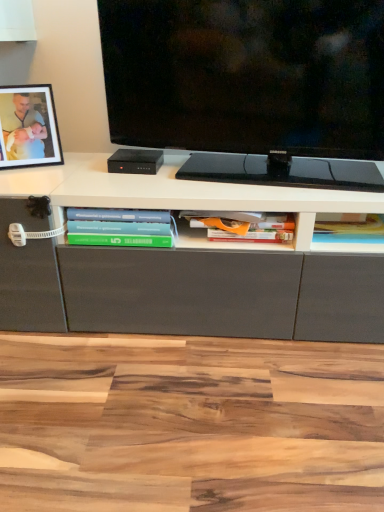
Question: Is black glossy tv at center wider than green matte book at lower left, which is the 1th book from left to right?

Choices:
 (A) no
 (B) yes

Answer: (A)

Question: Is black glossy tv at center completely or partially outside of green matte book at lower left, marked as the 3th book in a right-to-left arrangement?

Choices:
 (A) no
 (B) yes

Answer: (B)

Question: Does black glossy tv at center have a smaller size compared to green matte book at lower left, marked as the 3th book in a right-to-left arrangement?

Choices:
 (A) no
 (B) yes

Answer: (A)

Question: From the image's perspective, is black glossy tv at center on green matte book at lower left, which is the 1th book from left to right?

Choices:
 (A) no
 (B) yes

Answer: (B)

Question: Does black glossy tv at center have a greater height compared to green matte book at lower left, which is the 1th book from left to right?

Choices:
 (A) no
 (B) yes

Answer: (B)

Question: Based on their sizes in the image, would you say black matte picture frame at upper left is bigger or smaller than black glossy tv at center?

Choices:
 (A) big
 (B) small

Answer: (B)

Question: From a real-world perspective, is black matte picture frame at upper left physically located above or below black glossy tv at center?

Choices:
 (A) above
 (B) below

Answer: (B)

Question: Which is correct: black matte picture frame at upper left is inside black glossy tv at center, or outside of it?

Choices:
 (A) inside
 (B) outside

Answer: (B)

Question: Looking at their shapes, would you say black matte picture frame at upper left is wider or thinner than black glossy tv at center?

Choices:
 (A) thin
 (B) wide

Answer: (A)

Question: Is green matte book at lower left, which is the 1th book from left to right, in front of or behind black glossy tv at center in the image?

Choices:
 (A) behind
 (B) front

Answer: (A)

Question: Looking at the image, does green matte book at lower left, marked as the 3th book in a right-to-left arrangement, seem bigger or smaller compared to black glossy tv at center?

Choices:
 (A) small
 (B) big

Answer: (A)

Question: From the image's perspective, is green matte book at lower left, marked as the 3th book in a right-to-left arrangement, located above or below black glossy tv at center?

Choices:
 (A) below
 (B) above

Answer: (A)

Question: From their relative heights in the image, would you say green matte book at lower left, which is the 1th book from left to right, is taller or shorter than black glossy tv at center?

Choices:
 (A) tall
 (B) short

Answer: (B)

Question: Considering their positions, is black glossy tv at center located in front of or behind black matte picture frame at upper left?

Choices:
 (A) behind
 (B) front

Answer: (B)

Question: Is point (291, 75) positioned closer to the camera than point (43, 128)?

Choices:
 (A) farther
 (B) closer

Answer: (B)